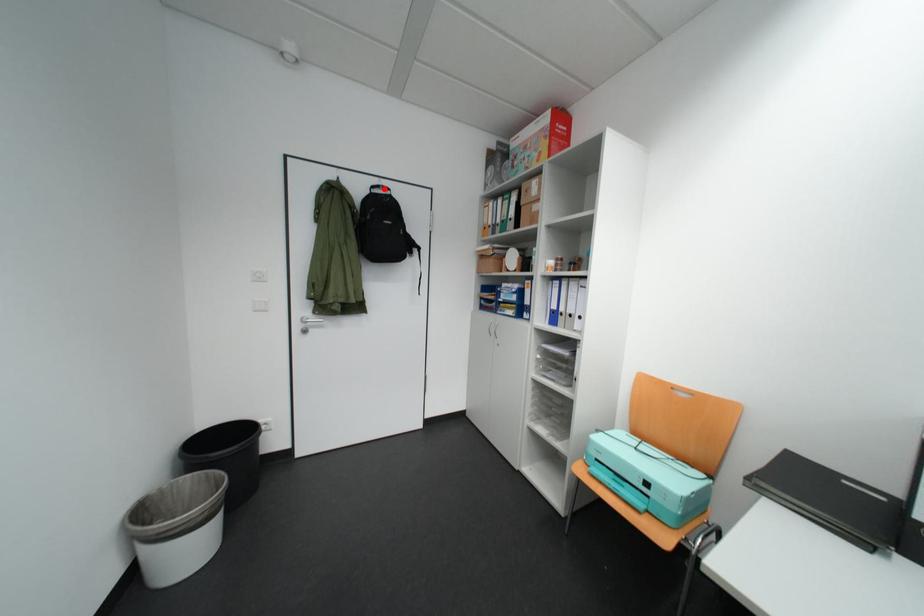
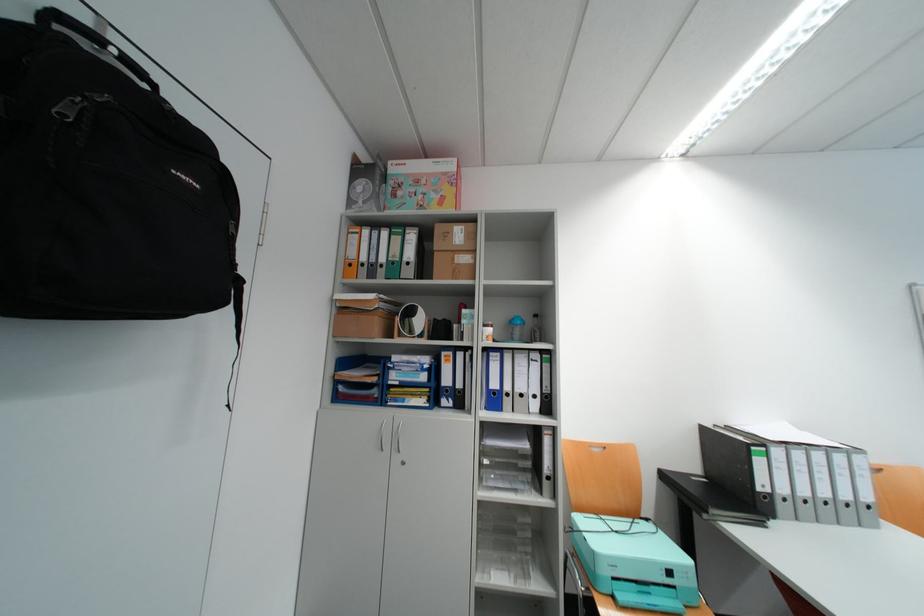
The point at the highlighted location is marked in the first image. Where is the corresponding point in the second image?

(73, 20)